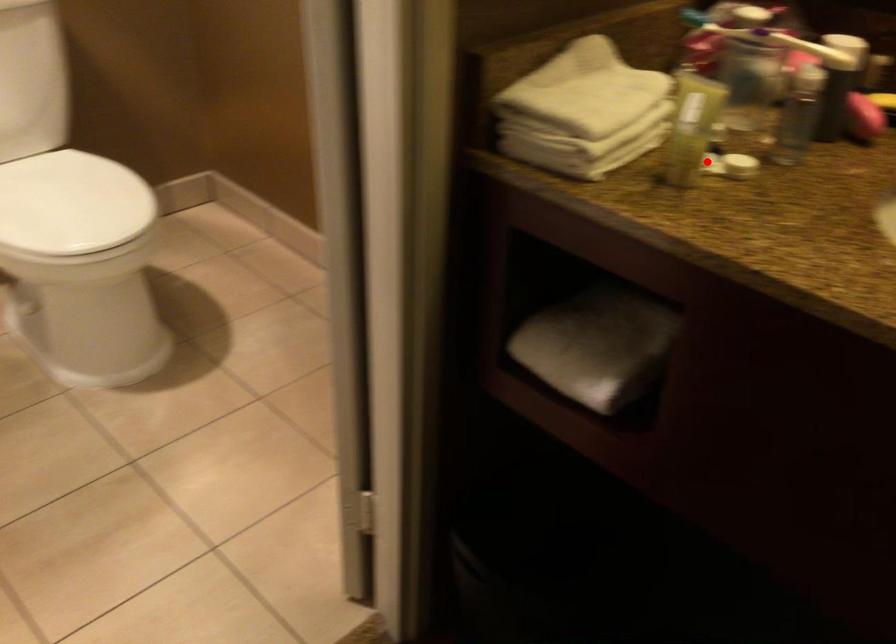
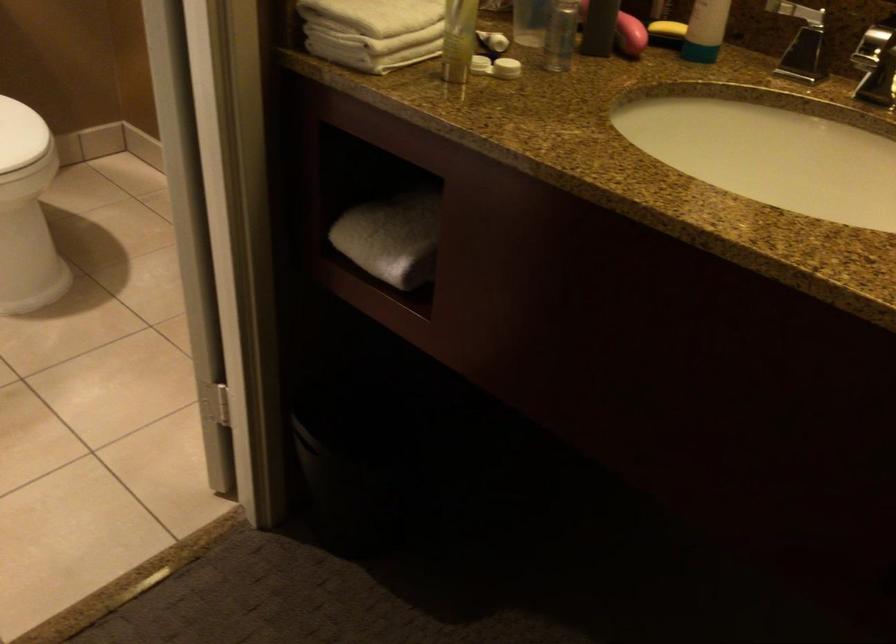
Question: A red point is marked in image1. In image2, is the corresponding 3D point closer to the camera or farther? Reply with the corresponding letter.

Choices:
 (A) The corresponding 3D point is closer.
 (B) The corresponding 3D point is farther.

Answer: (B)